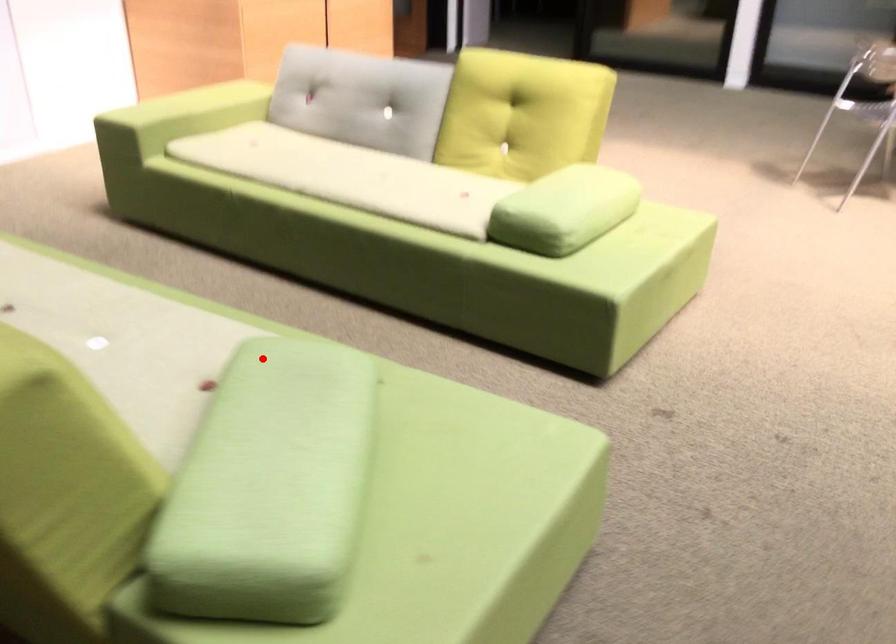
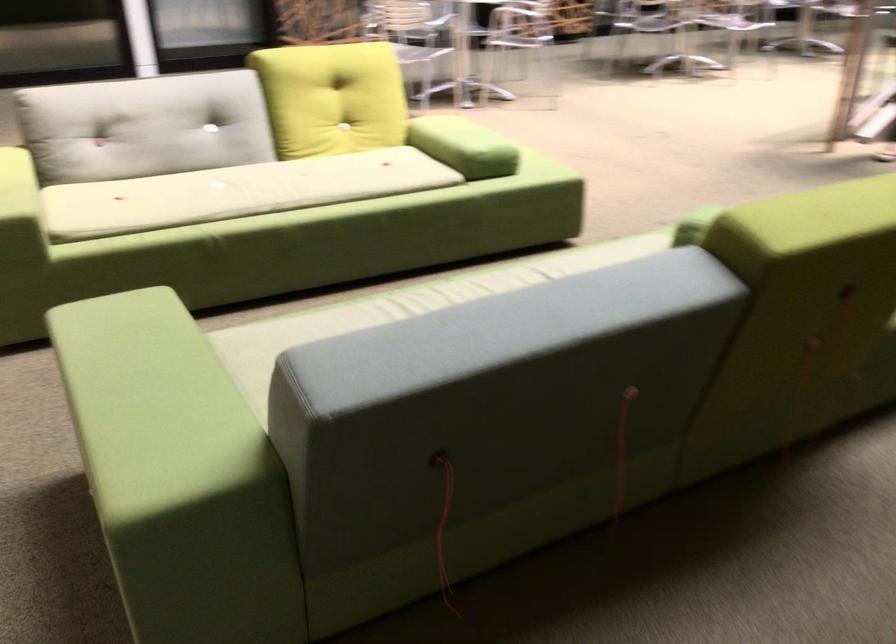
Where in the second image is the point corresponding to the highlighted location from the first image?

(694, 225)